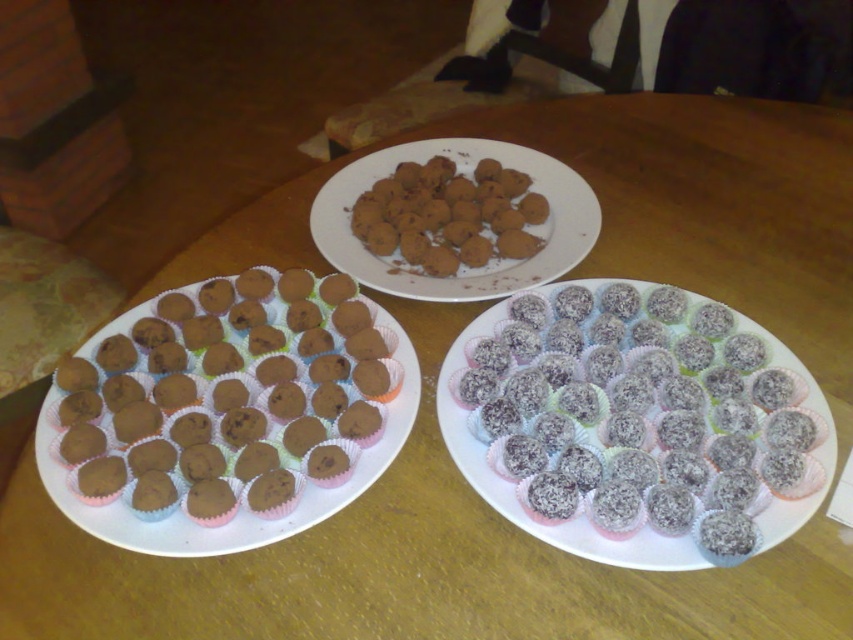
You are a photographer standing at a distance. You want to capture a closeup shot of the point at coordinates (548, 330) in the image. Given that the distance from the camera to this point is 79.07 centimeters, will you need to adjust your camera focus to ensure sharpness?

The point at coordinates (548, 330) is 79.07 centimeters away from the camera. To capture a sharp closeup, you should adjust the camera focus to match this distance.

Where are the chocolate matte muffins at left located in the image?

The chocolate matte muffins at left are located at point [227,397] in the image.